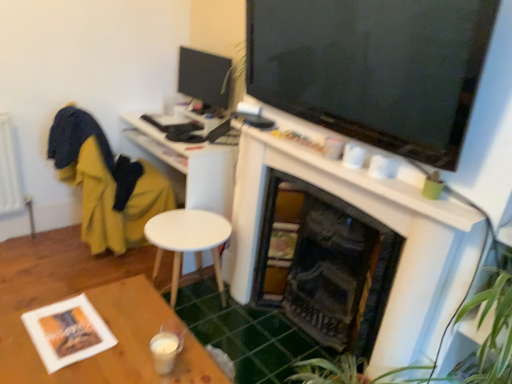
Question: Relative to white matte desk at center, is green leafy plant at lower right in front or behind?

Choices:
 (A) behind
 (B) front

Answer: (B)

Question: Looking at their shapes, would you say green leafy plant at lower right is wider or thinner than white matte desk at center?

Choices:
 (A) wide
 (B) thin

Answer: (B)

Question: Based on their relative distances, which object is nearer to the green leafy plant at lower right?

Choices:
 (A) yellow fabric swivel chair at left
 (B) white matte round table at center
 (C) white matte fireplace at upper center
 (D) matte black monitor at upper left
 (E) white matte desk at center

Answer: (C)

Question: Which of these objects is positioned farthest from the matte black monitor at upper left?

Choices:
 (A) yellow fabric swivel chair at left
 (B) green leafy plant at lower right
 (C) wooden table at lower left
 (D) white matte round table at center
 (E) white matte desk at center

Answer: (B)